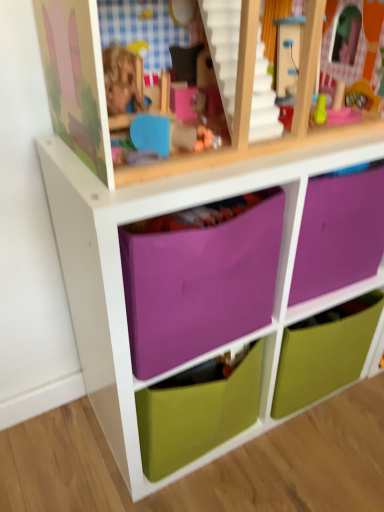
Question: Considering the relative positions of purple fabric drawer at center, acting as the second drawer starting from the bottom, and green matte drawer at center, which appears as the first drawer when ordered from the bottom, in the image provided, is purple fabric drawer at center, acting as the second drawer starting from the bottom, to the left or to the right of green matte drawer at center, which appears as the first drawer when ordered from the bottom,?

Choices:
 (A) left
 (B) right

Answer: (A)

Question: In terms of width, does purple fabric drawer at center, acting as the 2th drawer starting from the top, look wider or thinner when compared to green matte drawer at center, which appears as the first drawer when ordered from the bottom?

Choices:
 (A) thin
 (B) wide

Answer: (B)

Question: Based on their relative distances, which object is farther from the purple fabric drawer at center, acting as the second drawer starting from the bottom?

Choices:
 (A) green matte drawer at center, which appears as the first drawer when ordered from the bottom
 (B) purple fabric drawer at center, marked as the third drawer in a bottom-to-top arrangement

Answer: (A)

Question: Based on their relative distances, which object is farther from the green matte drawer at center, which appears as the first drawer when ordered from the bottom?

Choices:
 (A) purple fabric drawer at center, acting as the first drawer starting from the top
 (B) purple fabric drawer at center, acting as the second drawer starting from the bottom

Answer: (A)